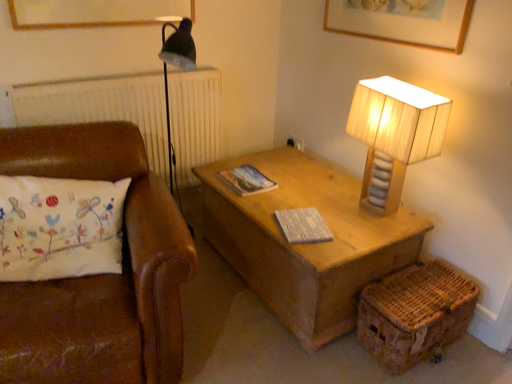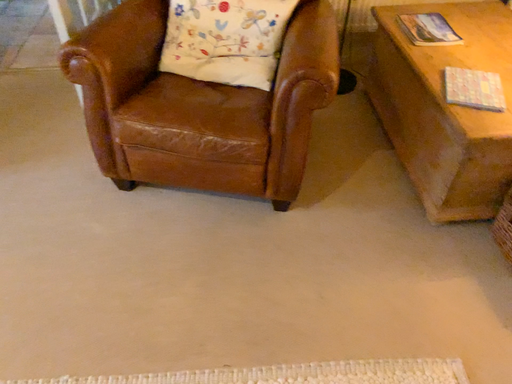
Question: Which way did the camera rotate in the video?

Choices:
 (A) rotated upward
 (B) rotated downward

Answer: (B)